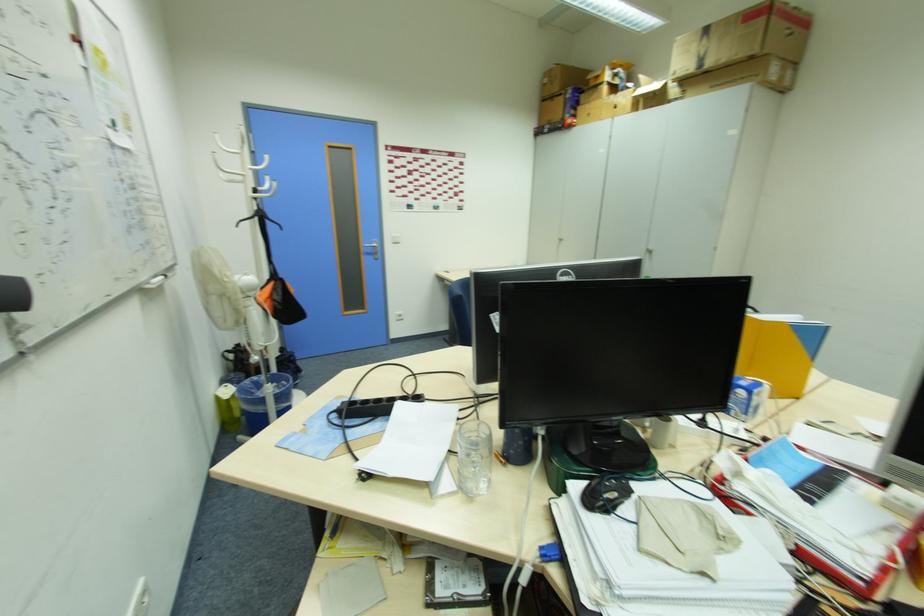
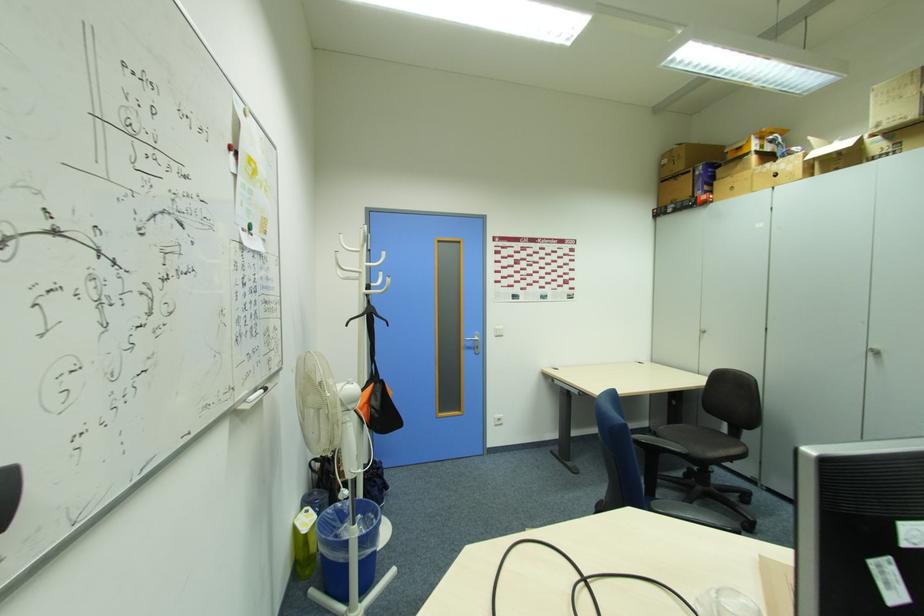
In the second image, find the point that corresponds to pixel 249 383 in the first image.

(334, 512)